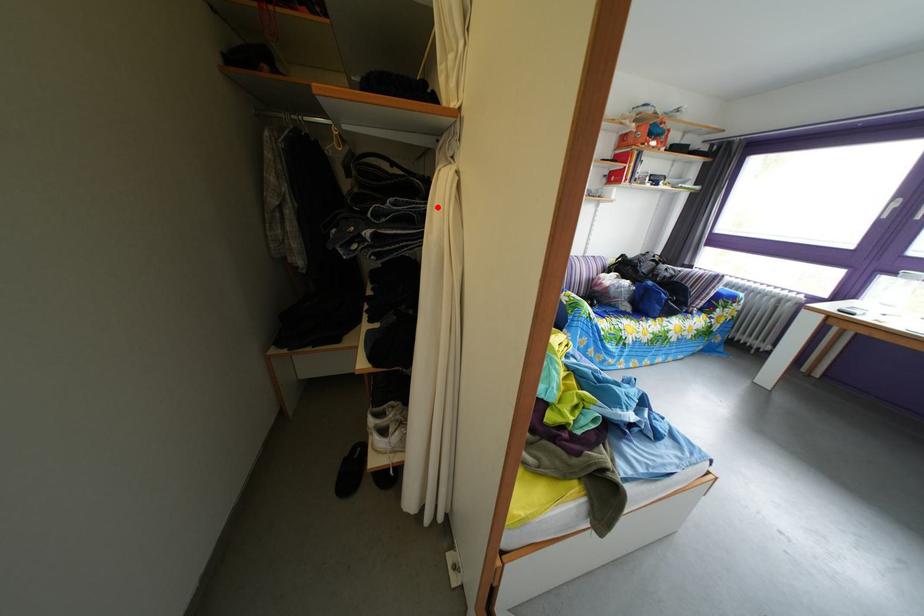
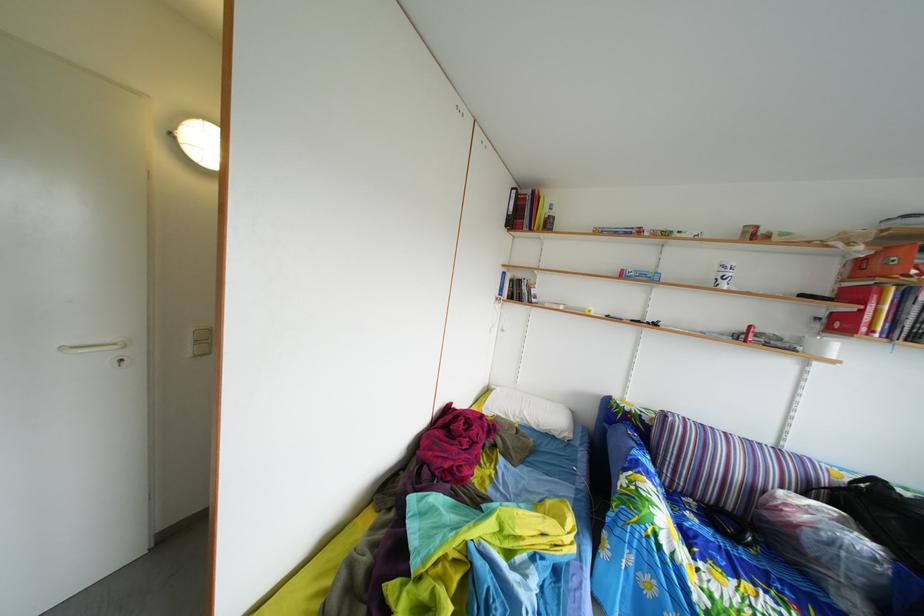
Question: I am providing you with two images of the same scene from different viewpoints. A red point is marked on the first image. Is the red point's position out of view in image 2?

Choices:
 (A) Yes
 (B) No

Answer: (A)